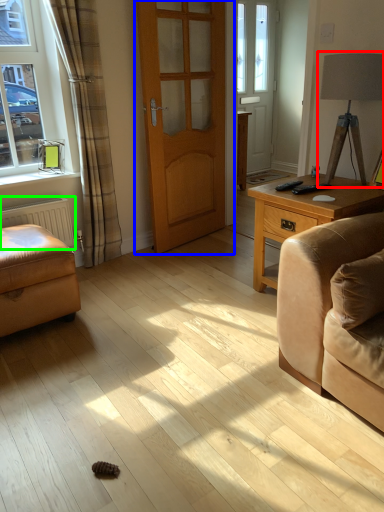
Question: Based on their relative distances, which object is farther from table lamp (highlighted by a red box)? Choose from door (highlighted by a blue box) and radiator (highlighted by a green box).

Choices:
 (A) door
 (B) radiator

Answer: (B)